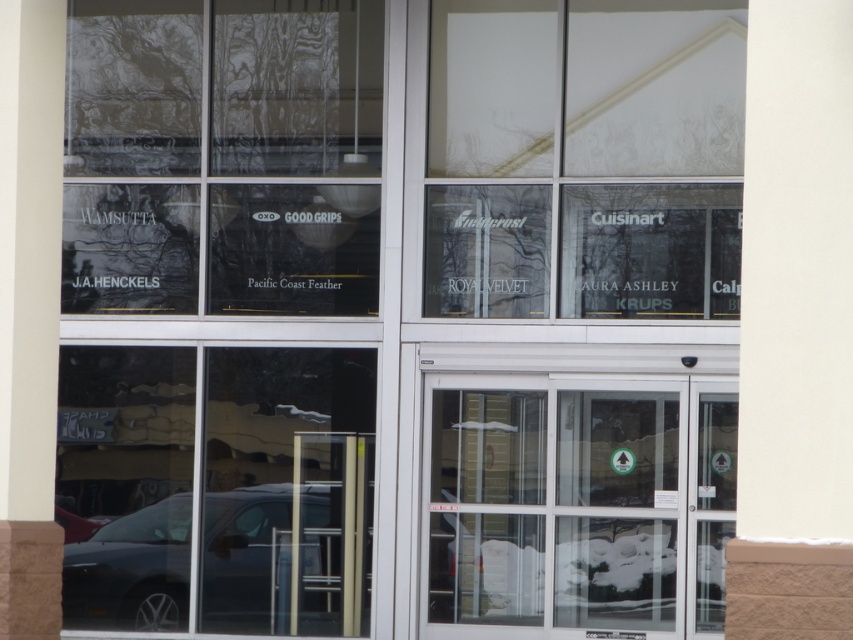
Is the position of transparent glass window at upper left less distant than that of dark gray metallic car at lower left?

No, transparent glass window at upper left is further to the viewer.

Which is in front, point (161, 93) or point (171, 616)?

Point (171, 616) is in front.

Locate an element on the screen. transparent glass window at upper left is located at coordinates (223, 157).

Based on the photo, measure the distance from white frosted glass at upper center to clear glass door at center.

white frosted glass at upper center and clear glass door at center are 3.33 feet apart.

What do you see at coordinates (585, 157) in the screenshot?
I see `white frosted glass at upper center` at bounding box center [585, 157].

At what (x,y) coordinates should I click in order to perform the action: click on white frosted glass at upper center. Please return your answer as a coordinate pair (x, y). The width and height of the screenshot is (853, 640). Looking at the image, I should click on [x=585, y=157].

From the picture: Can you confirm if transparent glass window at upper left is shorter than clear glass door at center?

Incorrect, transparent glass window at upper left's height does not fall short of clear glass door at center's.

Between transparent glass window at upper left and clear glass door at center, which one appears on the right side from the viewer's perspective?

Positioned to the right is clear glass door at center.

Between point (289, 252) and point (624, 433), which one is positioned behind?

Positioned behind is point (289, 252).

Locate an element on the screen. The image size is (853, 640). transparent glass window at upper left is located at coordinates (223, 157).